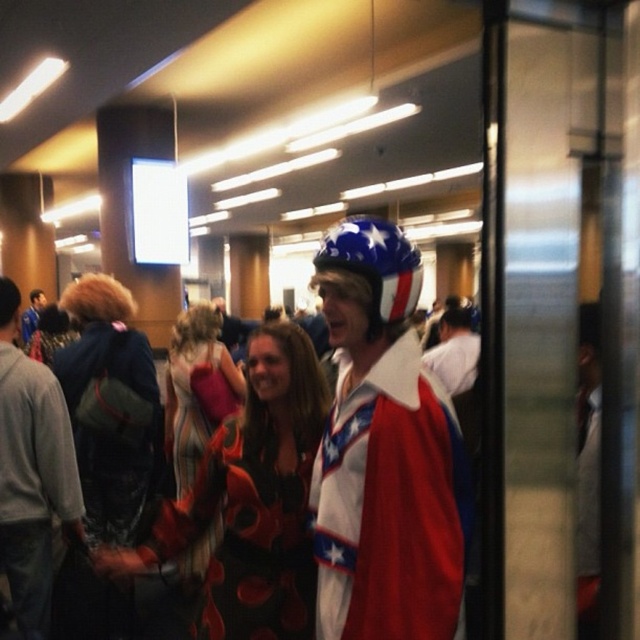
You are at the event and want to take a photo. You notice two points in the scene marked as point 1 at coordinates (188,493) and point 2 at (468,314). Which point is closer to you, point 1 or point 2?

Point 1 at coordinates (188,493) is closer to the viewer than point 2 at (468,314).

You are at the event and want to take a photo of the matte black dress at center. Where should you position yourself to capture it in the frame?

To capture the matte black dress at center in the frame, position yourself facing the center of the scene where the dress is located at coordinates approximately point 0.781 on the x and 0.394 on the y axis.

You are a photographer at this event and need to capture a photo of both the shiny metallic helmet at center and the matte black dress at center in the same frame. The camera you are using has a minimum focus distance of 12 inches. Will you be able to take the photo without moving either object?

The distance between the shiny metallic helmet at center and the matte black dress at center is 13.04 inches, which is greater than the camera minimum focus distance of 12 inches. Therefore, you can take the photo without moving either object.